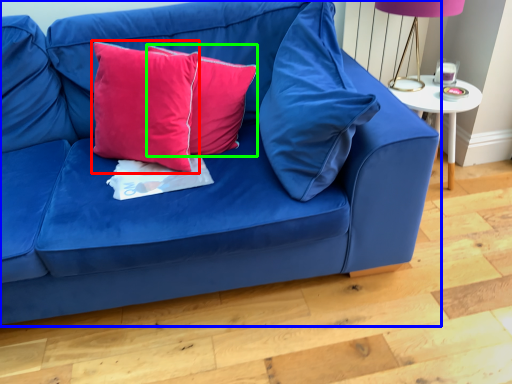
Question: Estimate the real-world distances between objects in this image. Which object is closer to pillow (highlighted by a red box), studio couch (highlighted by a blue box) or pillow (highlighted by a green box)?

Choices:
 (A) studio couch
 (B) pillow

Answer: (B)